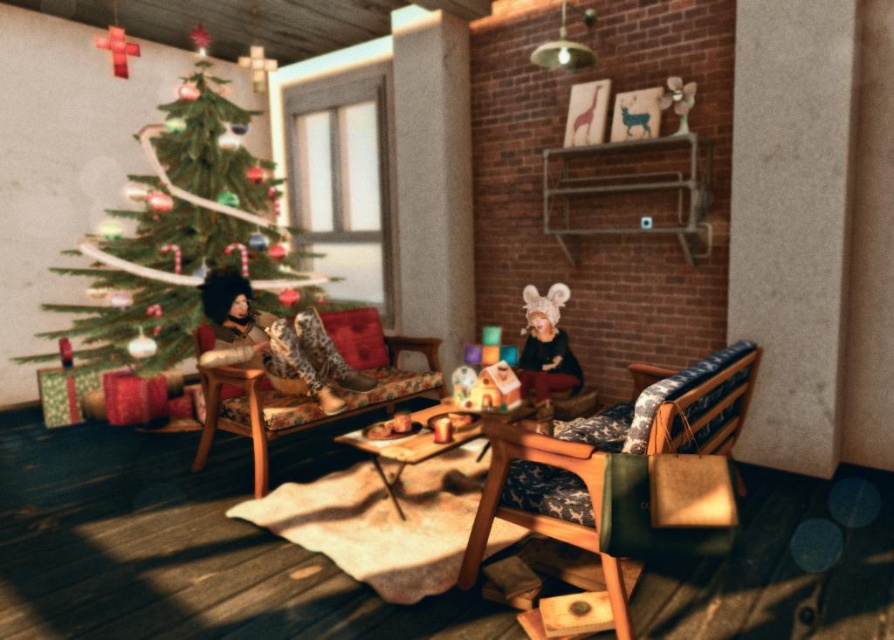
You are a delivery person who needs to place a large package on the floor near the wooden textured rocking chair at lower right and the leather boots at left. Which object should you avoid placing the package too close to, considering their heights?

You should avoid placing the package too close to the wooden textured rocking chair at lower right because it has a greater height compared to the leather boots at left, which might make it harder to access the package without bumping into the chair.

You are a guest in the living room and want to pick up the matte black doll at center. To reach it, you need to walk around the green matte christmas tree at left. Is the doll located behind the tree or in front of it?

The matte black doll at center is behind the green matte christmas tree at left, so you would need to go around the tree to reach it.